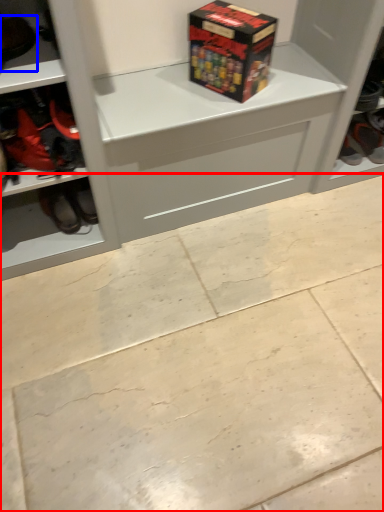
Question: Which object is closer to the camera taking this photo, concrete (highlighted by a red box) or footwear (highlighted by a blue box)?

Choices:
 (A) concrete
 (B) footwear

Answer: (A)